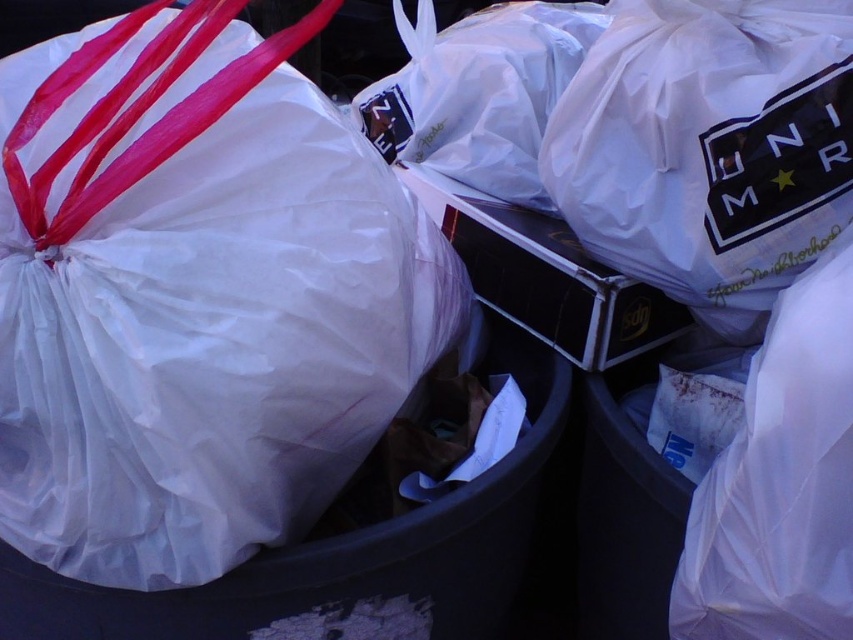
Does white plastic bag at left have a lesser height compared to white plastic bag at upper right?

No, white plastic bag at left is not shorter than white plastic bag at upper right.

Between white plastic bag at left and white plastic bag at upper right, which one has less height?

With less height is white plastic bag at upper right.

Between point (39, 122) and point (576, 227), which one is positioned behind?

Positioned behind is point (576, 227).

This screenshot has height=640, width=853. What are the coordinates of `white plastic bag at left` in the screenshot? It's located at (195, 296).